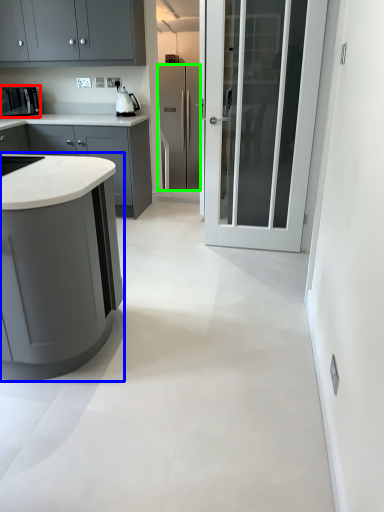
Question: Based on their relative distances, which object is nearer to kitchen appliance (highlighted by a red box)? Choose from cabinetry (highlighted by a blue box) and refrigerator (highlighted by a green box).

Choices:
 (A) cabinetry
 (B) refrigerator

Answer: (B)